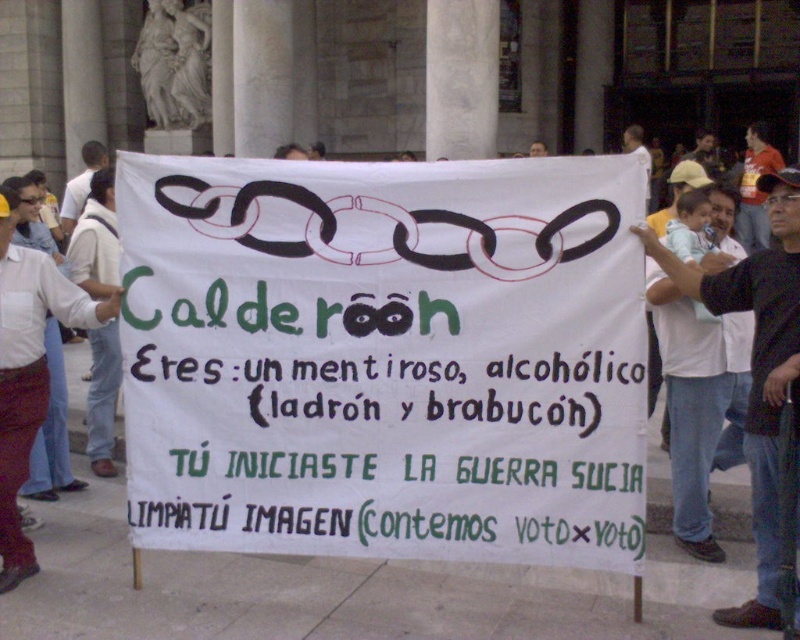
Can you confirm if white paper banner at center is positioned above white shirt at center?

Indeed, white paper banner at center is positioned over white shirt at center.

Is white paper banner at center shorter than white shirt at center?

Yes.

Which is in front, point (492, 259) or point (14, 536)?

Positioned in front is point (492, 259).

Find the location of a particular element. white paper banner at center is located at coordinates (384, 358).

Can you confirm if black shirt at upper right is bigger than light brown leather cap at upper right?

No, black shirt at upper right is not bigger than light brown leather cap at upper right.

Is black shirt at upper right closer to the viewer compared to light brown leather cap at upper right?

That is True.

Between point (756, 401) and point (701, 154), which one is positioned behind?

Point (701, 154)

At what (x,y) coordinates should I click in order to perform the action: click on black shirt at upper right. Please return your answer as a coordinate pair (x, y). Looking at the image, I should click on (760, 384).

Can you confirm if white paper banner at center is positioned to the right of light brown leather cap at upper right?

No, white paper banner at center is not to the right of light brown leather cap at upper right.

The image size is (800, 640). Describe the element at coordinates (384, 358) in the screenshot. I see `white paper banner at center` at that location.

At what (x,y) coordinates should I click in order to perform the action: click on white paper banner at center. Please return your answer as a coordinate pair (x, y). The height and width of the screenshot is (640, 800). Looking at the image, I should click on (384, 358).